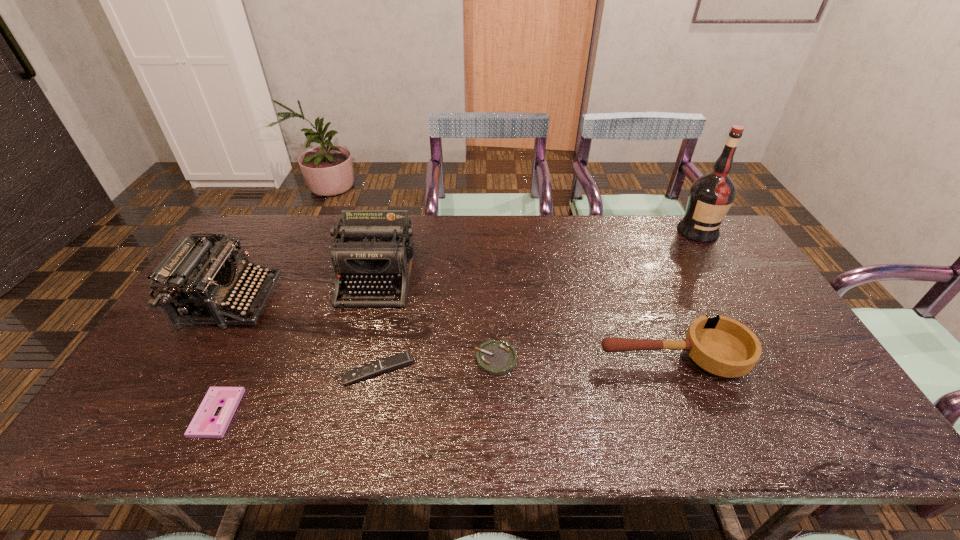
In order to click on free space between the farthest object and the fifth object from left to right in this screenshot , I will do `click(597, 295)`.

The width and height of the screenshot is (960, 540). I want to click on the third closest object to the shortest object, so click(376, 247).

Locate an element on the screen. This screenshot has width=960, height=540. object that stands as the second closest to the remote control is located at coordinates (376, 247).

You are a GUI agent. You are given a task and a screenshot of the screen. Output one action in this format:
    pyautogui.click(x=<x>, y=<y>)
    Task: Click on the vacant space that satisfies the following two spatial constraints: 1. on the typing side of the nearest object; 2. on the right side of the left typewriter
    
    Given the screenshot: What is the action you would take?
    pyautogui.click(x=166, y=413)

The image size is (960, 540). Find the location of `vacant space that satisfies the following two spatial constraints: 1. on the keyboard of the right typewriter; 2. on the left side of the remote control`. vacant space that satisfies the following two spatial constraints: 1. on the keyboard of the right typewriter; 2. on the left side of the remote control is located at coordinates (352, 370).

Identify the location of free space that satisfies the following two spatial constraints: 1. on the keyboard of the right typewriter; 2. on the typing side of the left typewriter. Image resolution: width=960 pixels, height=540 pixels. (371, 301).

Where is `vacant area that satisfies the following two spatial constraints: 1. on the back side of the remote control; 2. on the typing side of the left typewriter`? The image size is (960, 540). vacant area that satisfies the following two spatial constraints: 1. on the back side of the remote control; 2. on the typing side of the left typewriter is located at coordinates (393, 301).